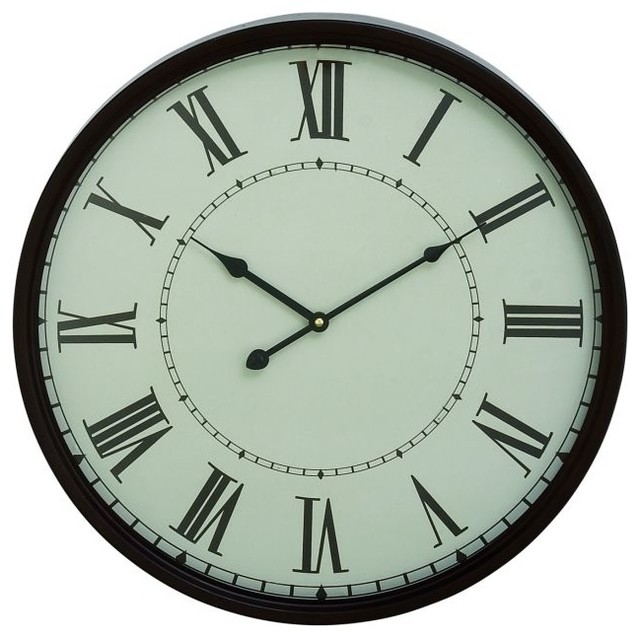
Locate an element on the screen. white clock face is located at coordinates (333, 247).